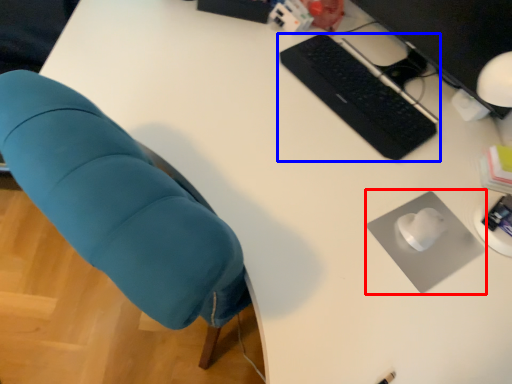
Question: Which object appears farthest to the camera in this image, mousepad (highlighted by a red box) or computer keyboard (highlighted by a blue box)?

Choices:
 (A) mousepad
 (B) computer keyboard

Answer: (B)